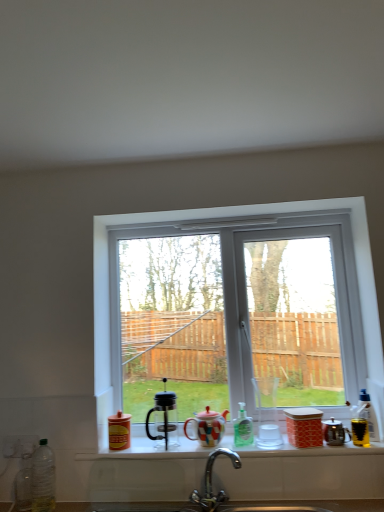
Question: From the image's perspective, is yellow plastic bottle at right, which appears as the first bottle when viewed from the right, under polished chrome faucet at lower center?

Choices:
 (A) yes
 (B) no

Answer: (B)

Question: From a real-world perspective, is yellow plastic bottle at right, which appears as the third bottle when viewed from the left, on top of polished chrome faucet at lower center?

Choices:
 (A) yes
 (B) no

Answer: (A)

Question: Can you confirm if yellow plastic bottle at right, which appears as the first bottle when viewed from the right, is taller than polished chrome faucet at lower center?

Choices:
 (A) no
 (B) yes

Answer: (A)

Question: From a real-world perspective, is yellow plastic bottle at right, which appears as the first bottle when viewed from the right, physically below polished chrome faucet at lower center?

Choices:
 (A) yes
 (B) no

Answer: (B)

Question: Is yellow plastic bottle at right, which appears as the first bottle when viewed from the right, positioned far away from polished chrome faucet at lower center?

Choices:
 (A) no
 (B) yes

Answer: (A)

Question: Is metallic silver kettle at right, which is the 2th appliance in right-to-left order, in front of or behind white glossy sink at lower center in the image?

Choices:
 (A) behind
 (B) front

Answer: (A)

Question: From the image's perspective, is metallic silver kettle at right, which is the 2th appliance in right-to-left order, positioned above or below white glossy sink at lower center?

Choices:
 (A) below
 (B) above

Answer: (B)

Question: From a real-world perspective, is metallic silver kettle at right, which is the second appliance from left to right, physically located above or below white glossy sink at lower center?

Choices:
 (A) above
 (B) below

Answer: (A)

Question: Is metallic silver kettle at right, which is the 2th appliance in right-to-left order, taller or shorter than white glossy sink at lower center?

Choices:
 (A) short
 (B) tall

Answer: (B)

Question: Is point [352, 446] positioned closer to the camera than point [102, 426]?

Choices:
 (A) farther
 (B) closer

Answer: (B)

Question: Is matte glass window sill at center situated inside white plastic window at center or outside?

Choices:
 (A) inside
 (B) outside

Answer: (B)

Question: From a real-world perspective, is matte glass window sill at center physically located above or below white plastic window at center?

Choices:
 (A) above
 (B) below

Answer: (B)

Question: Is matte glass window sill at center wider or thinner than white plastic window at center?

Choices:
 (A) wide
 (B) thin

Answer: (A)

Question: Does point (347, 434) appear closer or farther from the camera than point (362, 434)?

Choices:
 (A) closer
 (B) farther

Answer: (A)

Question: Is metallic silver kettle at right, which is the 2th appliance in right-to-left order, taller or shorter than metallic gold cup at right, the 3th appliance viewed from the left?

Choices:
 (A) tall
 (B) short

Answer: (A)